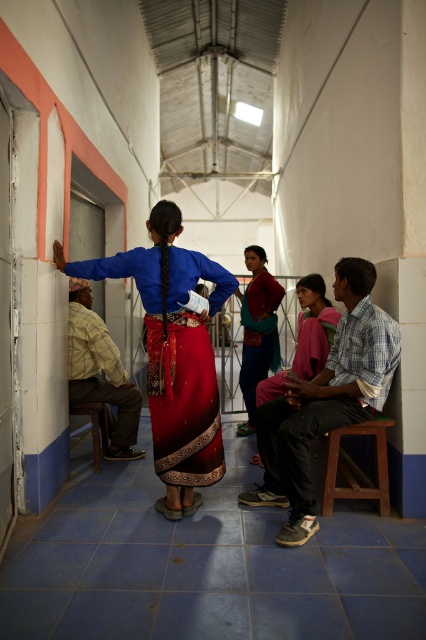
You are standing in the room and want to place a small potted plant between the brown wooden stool at lower right and the brown wooden chair at lower left. Based on their positions, which object should the plant be closer to if you want it centered between them?

The plant should be placed closer to the brown wooden chair at lower left because the brown wooden stool at lower right is to the right of the brown wooden chair at lower left, so the center point would be closer to the left side.

In the scene shown: You are a photographer setting up for a photoshoot in this room. You need to place a large tripod between the checkered fabric shirt at center and the brown wooden stool at lower right. Given their widths, will the tripod fit comfortably between them?

The checkered fabric shirt at center is wider than the brown wooden stool at lower right. Since the shirt is wider, there might not be enough space for the tripod to fit comfortably between them unless adjusted.